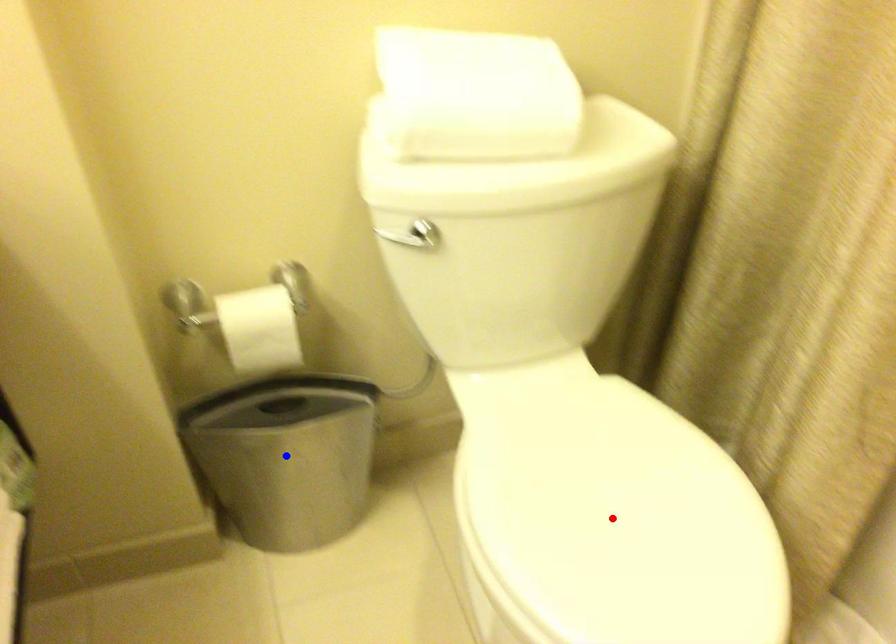
Question: Two points are marked on the image. Which point is closer to the camera?

Choices:
 (A) Blue point is closer.
 (B) Red point is closer.

Answer: (B)